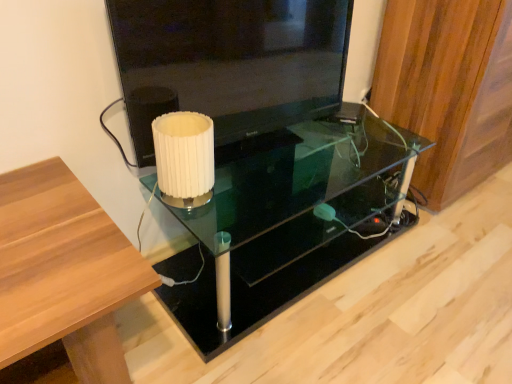
Question: Visually, is transparent glass table at center positioned to the left or to the right of white pleated paper at center?

Choices:
 (A) right
 (B) left

Answer: (A)

Question: Considering their positions, is transparent glass table at center located in front of or behind white pleated paper at center?

Choices:
 (A) front
 (B) behind

Answer: (A)

Question: Estimate the real-world distances between objects in this image. Which object is closer to the transparent glass table at center?

Choices:
 (A) wooden panel at right
 (B) white pleated paper at center
 (C) black glossy television at upper center

Answer: (C)

Question: Based on their relative distances, which object is nearer to the wooden panel at right?

Choices:
 (A) black glossy television at upper center
 (B) white pleated paper at center
 (C) transparent glass table at center

Answer: (C)